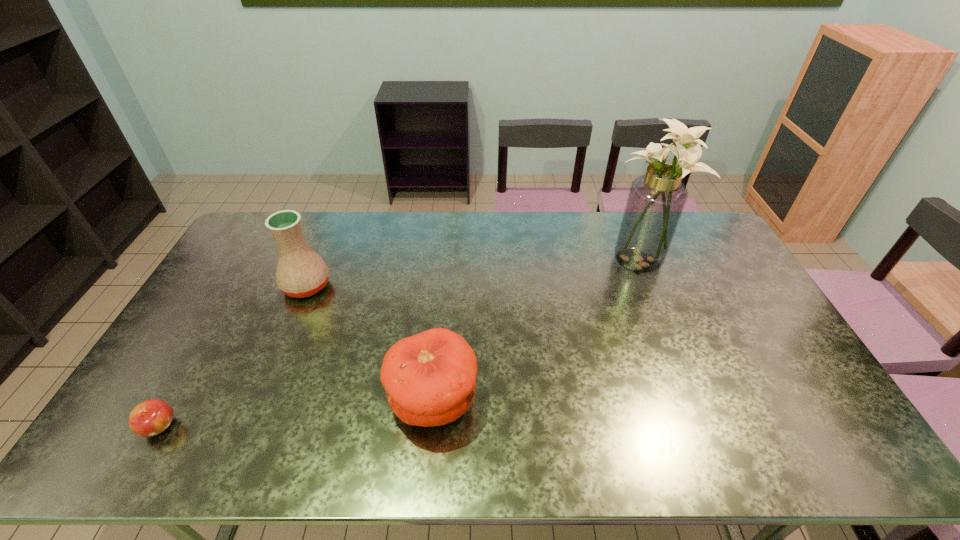
You are a GUI agent. You are given a task and a screenshot of the screen. Output one action in this format:
    pyautogui.click(x=<x>, y=<y>)
    Task: Click on the free space at the right edge of the desktop
    The image size is (960, 540).
    Given the screenshot: What is the action you would take?
    pyautogui.click(x=694, y=267)

The height and width of the screenshot is (540, 960). I want to click on free space at the near right corner of the desktop, so click(x=782, y=434).

In order to click on empty location between the pumpkin and the shortest object in this screenshot , I will do `click(297, 414)`.

Locate an element on the screen. vacant area that lies between the third tallest object and the rightmost object is located at coordinates (536, 330).

I want to click on vacant space that is in between the apple and the second object from left to right, so click(x=233, y=356).

In order to click on vacant area that lies between the tallest object and the second object from right to left in this screenshot , I will do tap(536, 330).

Find the location of a particular element. Image resolution: width=960 pixels, height=540 pixels. vacant area that lies between the apple and the pottery is located at coordinates (233, 356).

What are the coordinates of `vacant area that lies between the pottery and the shortest object` in the screenshot? It's located at (233, 356).

You are a GUI agent. You are given a task and a screenshot of the screen. Output one action in this format:
    pyautogui.click(x=<x>, y=<y>)
    Task: Click on the unoccupied position between the apple and the third shortest object
    This screenshot has height=540, width=960.
    Given the screenshot: What is the action you would take?
    pyautogui.click(x=233, y=356)

Locate an element on the screen. The width and height of the screenshot is (960, 540). vacant space in between the pottery and the tallest object is located at coordinates (472, 273).